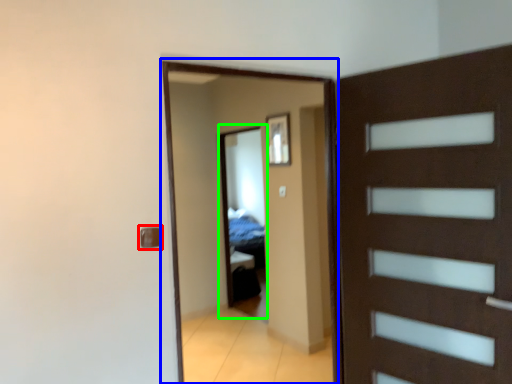
Question: Considering the real-world distances, which object is farthest from door handle (highlighted by a red box)? screen door (highlighted by a blue box) or mirror (highlighted by a green box)?

Choices:
 (A) screen door
 (B) mirror

Answer: (B)